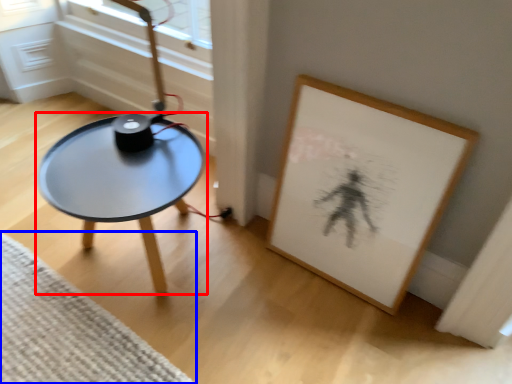
Question: Which point is closer to the camera, coffee table (highlighted by a red box) or mat (highlighted by a blue box)?

Choices:
 (A) coffee table
 (B) mat

Answer: (B)